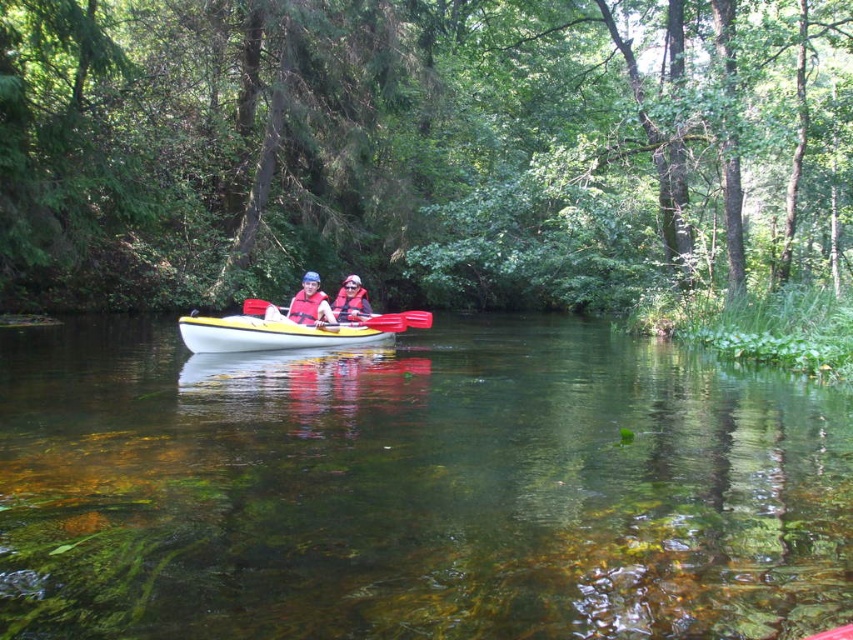
You are a photographer planning to capture the kayakers from above. Considering the clear water at center and the matte blue life vest at center, which object would appear wider in your aerial photo?

The clear water at center would appear wider in the aerial photo since its width is larger than that of the matte blue life vest at center.

You are a photographer trying to capture the matte red life vest at center and the yellow plastic paddle at center in the same frame. Based on their positions, which object should you focus on first to ensure both are in the shot?

The matte red life vest at center is positioned over the yellow plastic paddle at center, so you should focus on the matte red life vest at center first to ensure both are in the shot.